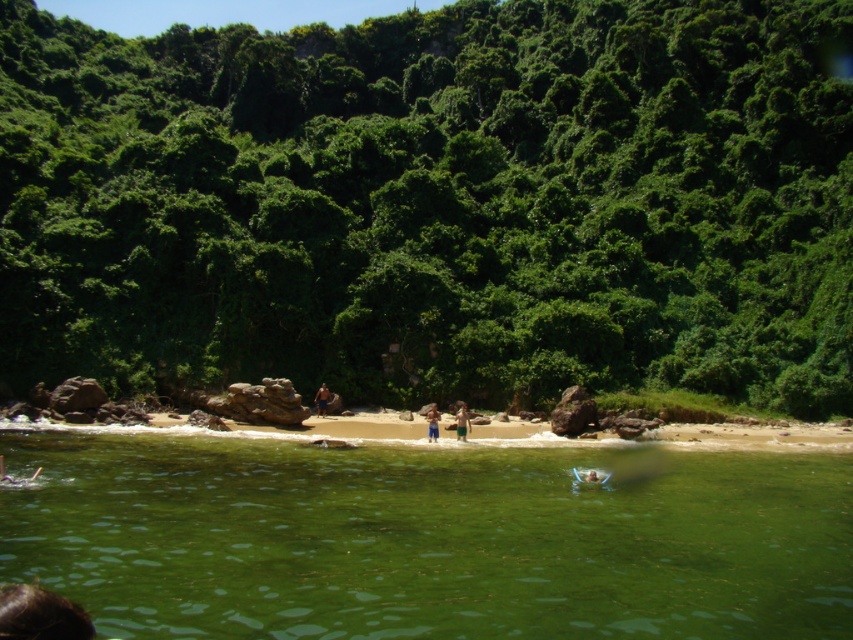
Question: Is green shorts at center to the right of brown textured shorts at center from the viewer's perspective?

Choices:
 (A) yes
 (B) no

Answer: (A)

Question: Considering the real-world distances, which object is farthest from the green leafy vegetation at center?

Choices:
 (A) tan skin person at center
 (B) green shorts at center

Answer: (B)

Question: Which of these objects is positioned farthest from the brown textured shorts at center?

Choices:
 (A) green translucent water at center
 (B) green shorts at center
 (C) green leafy vegetation at center
 (D) tan skin person at center

Answer: (C)

Question: Is green shorts at center wider than brown textured shorts at center?

Choices:
 (A) no
 (B) yes

Answer: (B)

Question: Is green shorts at center to the right of brown textured shorts at center from the viewer's perspective?

Choices:
 (A) yes
 (B) no

Answer: (A)

Question: Which point is closer to the camera?

Choices:
 (A) green shorts at center
 (B) tan skin person at center
 (C) green translucent water at center
 (D) brown textured shorts at center

Answer: (C)